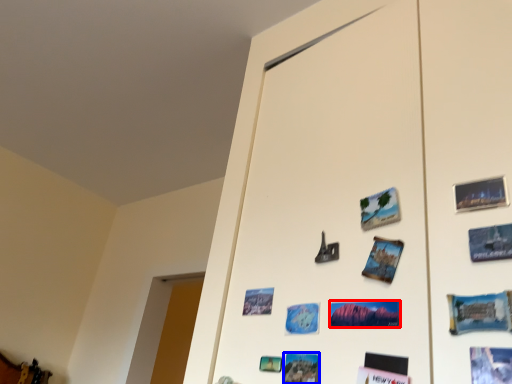
Question: Which object is closer to the camera taking this photo, postcard (highlighted by a red box) or postcard (highlighted by a blue box)?

Choices:
 (A) postcard
 (B) postcard

Answer: (A)